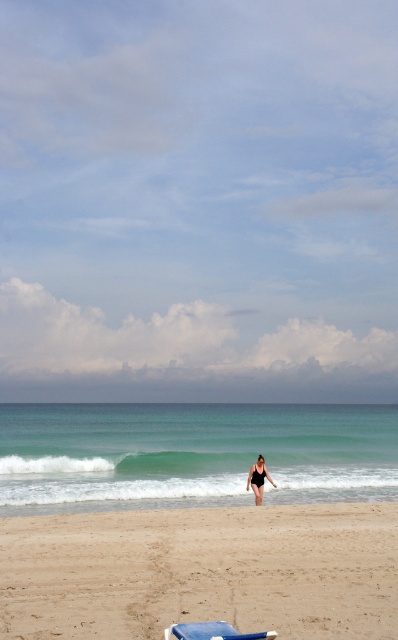
Question: Which point is farther from the camera taking this photo?

Choices:
 (A) (257, 493)
 (B) (216, 634)

Answer: (A)

Question: Does blue plastic beach chair at lower center appear on the right side of black matte swimsuit at center?

Choices:
 (A) no
 (B) yes

Answer: (A)

Question: Which point is closer to the camera?

Choices:
 (A) beige sandy beach at center
 (B) blue plastic beach chair at lower center
 (C) black matte swimsuit at center

Answer: (B)

Question: Does beige sandy beach at center have a smaller size compared to blue plastic beach chair at lower center?

Choices:
 (A) yes
 (B) no

Answer: (B)

Question: Which is nearer to the beige sandy beach at center?

Choices:
 (A) black matte swimsuit at center
 (B) blue plastic beach chair at lower center

Answer: (A)

Question: Does blue plastic beach chair at lower center appear on the right side of black matte swimsuit at center?

Choices:
 (A) no
 (B) yes

Answer: (A)